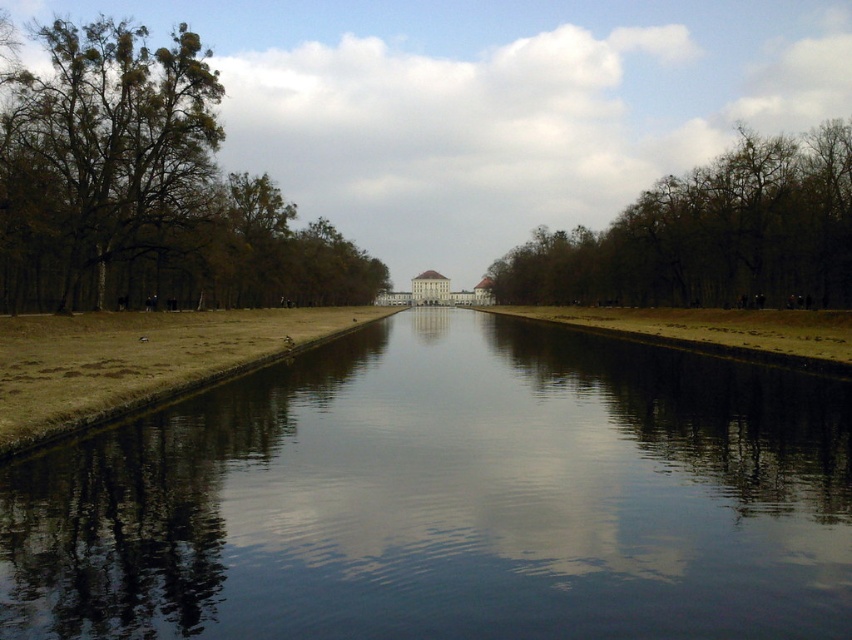
Which is behind, point (669, 538) or point (661, 257)?

The point (661, 257) is behind.

Is smooth reflective water at center smaller than brown leafless trees at center?

Indeed, smooth reflective water at center has a smaller size compared to brown leafless trees at center.

Locate an element on the screen. The height and width of the screenshot is (640, 852). smooth reflective water at center is located at coordinates (447, 499).

Is point (4, 209) positioned behind point (730, 186)?

No, (4, 209) is closer to viewer.

Who is positioned more to the right, green leafy tree at left or brown leafless trees at center?

brown leafless trees at center

Does point (3, 250) come farther from viewer compared to point (756, 282)?

No, (3, 250) is closer to viewer.

Find the location of `green leafy tree at left`. green leafy tree at left is located at coordinates (147, 189).

Which is below, smooth reflective water at center or green leafy tree at left?

smooth reflective water at center is below.

Identify the location of smooth reflective water at center. The image size is (852, 640). (447, 499).